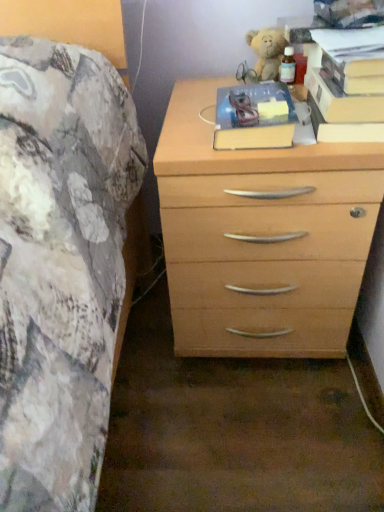
Find the location of a particular element. Image resolution: width=384 pixels, height=512 pixels. free spot in front of hardcover book at center, the 3th paperback book viewed from the right is located at coordinates (274, 155).